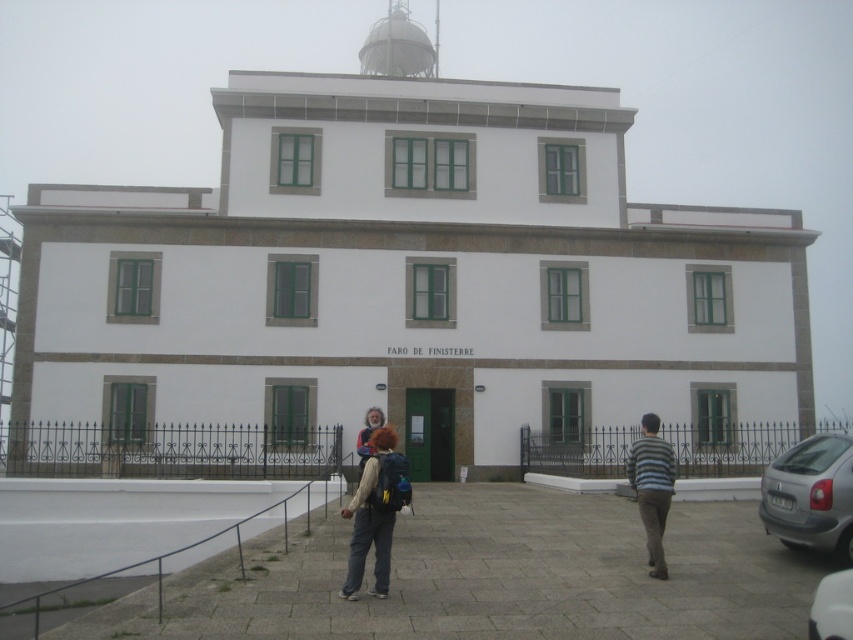
You are standing at the entrance of the FARO DE FINISTERRE building and need to park your car. The parking space available is exactly the width of the striped cotton shirt at right. Can your silver metallic car at lower right fit into this space?

The silver metallic car at lower right is wider than the striped cotton shirt at right, so it cannot fit into the parking space that matches the shirt width.

You are standing at the entrance of the FARO DE FINISTERRE building and want to park your car. Based on the image, can you determine the exact coordinates where the silver metallic car at lower right is parked?

The silver metallic car at lower right is parked at coordinates point (811,496).

You are standing at the entrance of the FARO DE FINISTERRE building and want to park your car. The parking space available is exactly the width of the matte white backpack at center. Can your silver metallic car at lower right fit into this space?

The silver metallic car at lower right is wider than the matte white backpack at center, so it cannot fit into the parking space that matches the backpacks width.